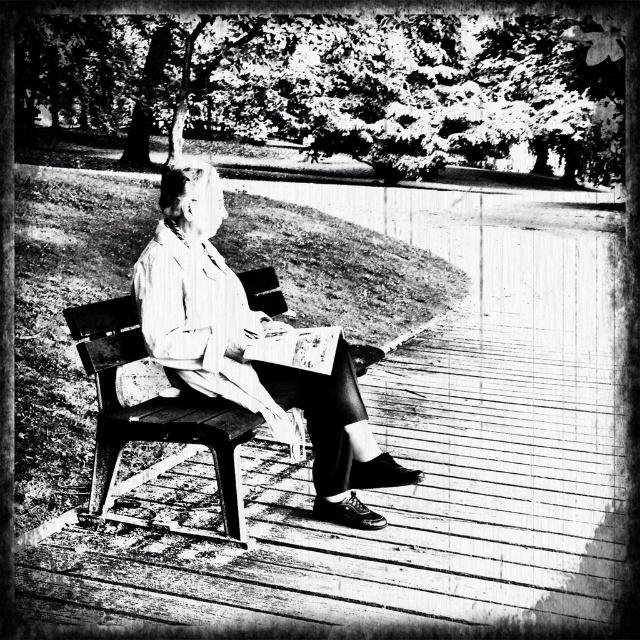
You are standing at the entrance of the deck and see the striped fabric coat at center. If you walk straight towards the coat, will you first encounter the wooden bench or the deck?

The striped fabric coat at center is located at point (243, 348), which is on the deck. Therefore, walking straight towards the coat, you would first encounter the deck before reaching the bench.

You are organizing a small event and need to place a decorative pillow on the seat of the wooden bench at center. The pillow you have is the same size as the striped fabric coat at center. Will the pillow fit on the bench?

The striped fabric coat at center has a larger size compared to wooden bench at center. Since the pillow is the same size as the coat, it may not fit on the bench.

You are a photographer trying to capture both the wooden bench at center and the paperback book at center in a single frame. Based on their heights, which object will appear larger in the photo?

The wooden bench at center is taller than the paperback book at center, so it will appear larger in the photo.